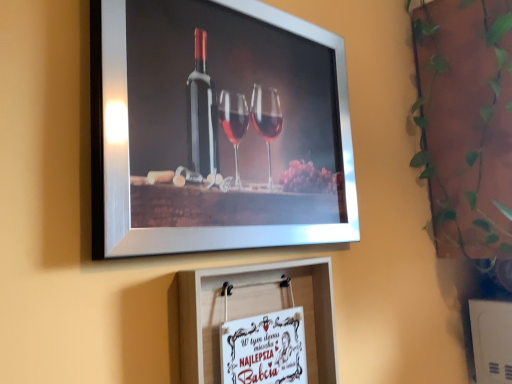
Locate an element on the screen. The height and width of the screenshot is (384, 512). white paper at center, placed as the 1th picture frame when sorted from bottom to top is located at coordinates (255, 312).

I want to click on green leafy plant at upper right, so click(466, 124).

Looking at their sizes, would you say metallic silver picture frame at upper center, the 1th picture frame from the top, is wider or thinner than white paper at center, arranged as the 2th picture frame when viewed from the top?

metallic silver picture frame at upper center, the 1th picture frame from the top, is thinner than white paper at center, arranged as the 2th picture frame when viewed from the top.

Is metallic silver picture frame at upper center, the 1th picture frame from the top, completely or partially outside of white paper at center, placed as the 1th picture frame when sorted from bottom to top?

Yes, metallic silver picture frame at upper center, the 1th picture frame from the top, is not within white paper at center, placed as the 1th picture frame when sorted from bottom to top.

Is point (144, 144) behind point (318, 296)?

No, (144, 144) is in front of (318, 296).

From a real-world perspective, does metallic silver picture frame at upper center, placed as the second picture frame when sorted from bottom to top, stand above white paper at center, arranged as the 2th picture frame when viewed from the top?

Correct, in the physical world, metallic silver picture frame at upper center, placed as the second picture frame when sorted from bottom to top, is higher than white paper at center, arranged as the 2th picture frame when viewed from the top.

Which is behind, point (146, 84) or point (495, 52)?

The point (495, 52) is farther from the camera.

In order to click on plant that is above the metallic silver picture frame at upper center, placed as the second picture frame when sorted from bottom to top (from the image's perspective) in this screenshot , I will do `click(466, 124)`.

Looking at this image, are metallic silver picture frame at upper center, the 1th picture frame from the top, and green leafy plant at upper right far apart?

That's not correct — metallic silver picture frame at upper center, the 1th picture frame from the top, is a little close to green leafy plant at upper right.

Could you measure the distance between metallic silver picture frame at upper center, the 1th picture frame from the top, and green leafy plant at upper right?

metallic silver picture frame at upper center, the 1th picture frame from the top, is 21.31 inches away from green leafy plant at upper right.

Is point (472, 108) closer or farther from the camera than point (201, 332)?

Point (472, 108) is positioned farther from the camera compared to point (201, 332).

Image resolution: width=512 pixels, height=384 pixels. Identify the location of the 1st picture frame counting from the left side of the green leafy plant at upper right. (255, 312).

How many degrees apart are the facing directions of green leafy plant at upper right and white paper at center, placed as the 1th picture frame when sorted from bottom to top?

1.42 degrees separate the facing orientations of green leafy plant at upper right and white paper at center, placed as the 1th picture frame when sorted from bottom to top.

Is green leafy plant at upper right positioned with its back to white paper at center, arranged as the 2th picture frame when viewed from the top?

No, white paper at center, arranged as the 2th picture frame when viewed from the top, is not at the back of green leafy plant at upper right.

Is green leafy plant at upper right next to metallic silver picture frame at upper center, the 1th picture frame from the top, and touching it?

No, green leafy plant at upper right is not touching metallic silver picture frame at upper center, the 1th picture frame from the top.

Is green leafy plant at upper right completely or partially outside of metallic silver picture frame at upper center, the 1th picture frame from the top?

green leafy plant at upper right lies outside metallic silver picture frame at upper center, the 1th picture frame from the top,'s area.

Does point (452, 249) appear closer or farther from the camera than point (154, 132)?

Clearly, point (452, 249) is more distant from the camera than point (154, 132).

The height and width of the screenshot is (384, 512). I want to click on plant behind the metallic silver picture frame at upper center, placed as the second picture frame when sorted from bottom to top, so click(466, 124).

Is white paper at center, arranged as the 2th picture frame when viewed from the top, beside green leafy plant at upper right?

No, white paper at center, arranged as the 2th picture frame when viewed from the top, is not making contact with green leafy plant at upper right.

Based on the photo, is green leafy plant at upper right at the back of white paper at center, placed as the 1th picture frame when sorted from bottom to top?

white paper at center, placed as the 1th picture frame when sorted from bottom to top, does not have its back to green leafy plant at upper right.

Considering the relative positions of white paper at center, placed as the 1th picture frame when sorted from bottom to top, and green leafy plant at upper right in the image provided, is white paper at center, placed as the 1th picture frame when sorted from bottom to top, behind green leafy plant at upper right?

No, it is not.

Is point (185, 276) positioned in front of point (438, 182)?

Yes, it is.

What are the coordinates of `picture frame below the metallic silver picture frame at upper center, the 1th picture frame from the top (from a real-world perspective)` in the screenshot? It's located at (255, 312).

Is white paper at center, arranged as the 2th picture frame when viewed from the top, oriented towards metallic silver picture frame at upper center, the 1th picture frame from the top?

No, white paper at center, arranged as the 2th picture frame when viewed from the top, is not facing towards metallic silver picture frame at upper center, the 1th picture frame from the top.

From the image's perspective, which is above, white paper at center, arranged as the 2th picture frame when viewed from the top, or metallic silver picture frame at upper center, placed as the second picture frame when sorted from bottom to top?

metallic silver picture frame at upper center, placed as the second picture frame when sorted from bottom to top.

From a real-world perspective, who is located higher, white paper at center, placed as the 1th picture frame when sorted from bottom to top, or metallic silver picture frame at upper center, placed as the second picture frame when sorted from bottom to top?

In real-world perspective, metallic silver picture frame at upper center, placed as the second picture frame when sorted from bottom to top, is above.

Identify the location of picture frame directly beneath the metallic silver picture frame at upper center, the 1th picture frame from the top (from a real-world perspective). This screenshot has width=512, height=384. (255, 312).

Find the location of a particular element. Image resolution: width=512 pixels, height=384 pixels. plant above the metallic silver picture frame at upper center, the 1th picture frame from the top (from a real-world perspective) is located at coordinates (466, 124).

Considering their positions, is green leafy plant at upper right positioned closer to metallic silver picture frame at upper center, the 1th picture frame from the top, than white paper at center, arranged as the 2th picture frame when viewed from the top?

Based on the image, white paper at center, arranged as the 2th picture frame when viewed from the top, appears to be nearer to metallic silver picture frame at upper center, the 1th picture frame from the top.

When comparing their distances from metallic silver picture frame at upper center, the 1th picture frame from the top, does white paper at center, placed as the 1th picture frame when sorted from bottom to top, or green leafy plant at upper right seem closer?

white paper at center, placed as the 1th picture frame when sorted from bottom to top.

Estimate the real-world distances between objects in this image. Which object is further from white paper at center, arranged as the 2th picture frame when viewed from the top, green leafy plant at upper right or metallic silver picture frame at upper center, placed as the second picture frame when sorted from bottom to top?

green leafy plant at upper right is positioned further to the anchor white paper at center, arranged as the 2th picture frame when viewed from the top.

From the image, which object appears to be farther from white paper at center, placed as the 1th picture frame when sorted from bottom to top, metallic silver picture frame at upper center, placed as the second picture frame when sorted from bottom to top, or green leafy plant at upper right?

green leafy plant at upper right lies further to white paper at center, placed as the 1th picture frame when sorted from bottom to top, than the other object.

From the image, which object appears to be nearer to green leafy plant at upper right, white paper at center, arranged as the 2th picture frame when viewed from the top, or metallic silver picture frame at upper center, placed as the second picture frame when sorted from bottom to top?

metallic silver picture frame at upper center, placed as the second picture frame when sorted from bottom to top.

Considering their positions, is metallic silver picture frame at upper center, placed as the second picture frame when sorted from bottom to top, positioned closer to green leafy plant at upper right than white paper at center, arranged as the 2th picture frame when viewed from the top?

metallic silver picture frame at upper center, placed as the second picture frame when sorted from bottom to top, lies closer to green leafy plant at upper right than the other object.

Image resolution: width=512 pixels, height=384 pixels. I want to click on picture frame situated between metallic silver picture frame at upper center, the 1th picture frame from the top, and green leafy plant at upper right from left to right, so click(x=255, y=312).